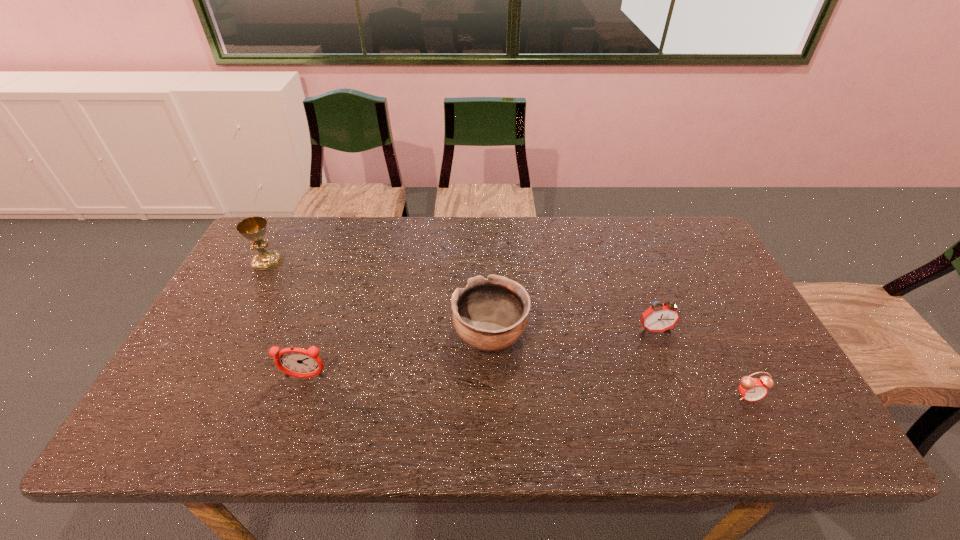
Select which alarm clock is the second closest to the leftmost object. Please provide its 2D coordinates. Your answer should be formatted as a tuple, i.e. [(x, y)], where the tuple contains the x and y coordinates of a point satisfying the conditions above.

[(659, 317)]

Identify which alarm clock is the nearest to the farthest alarm clock. Please provide its 2D coordinates. Your answer should be formatted as a tuple, i.e. [(x, y)], where the tuple contains the x and y coordinates of a point satisfying the conditions above.

[(752, 389)]